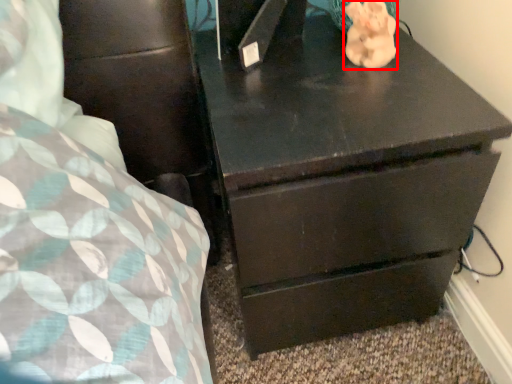
Question: From the image's perspective, where is animal (annotated by the red box) located in relation to chest of drawers in the image?

Choices:
 (A) above
 (B) below

Answer: (A)